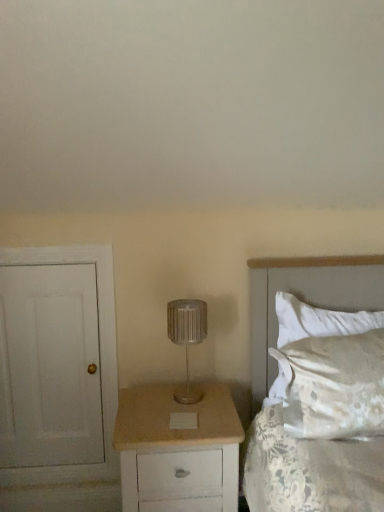
Question: Is white painted wood door at left positioned in front of white satin pillow at right?

Choices:
 (A) no
 (B) yes

Answer: (A)

Question: Does white painted wood door at left have a lesser width compared to white satin pillow at right?

Choices:
 (A) yes
 (B) no

Answer: (A)

Question: From the image's perspective, does white painted wood door at left appear higher than white satin pillow at right?

Choices:
 (A) yes
 (B) no

Answer: (B)

Question: Can you confirm if white painted wood door at left is shorter than white satin pillow at right?

Choices:
 (A) no
 (B) yes

Answer: (A)

Question: Is white satin pillow at right surrounded by white painted wood door at left?

Choices:
 (A) no
 (B) yes

Answer: (A)

Question: Is white painted wood door at left not within white satin pillow at right?

Choices:
 (A) yes
 (B) no

Answer: (A)

Question: Is white painted wood door at left in contact with white satin bed at right?

Choices:
 (A) yes
 (B) no

Answer: (B)

Question: Considering the relative sizes of white painted wood door at left and white satin bed at right in the image provided, is white painted wood door at left thinner than white satin bed at right?

Choices:
 (A) yes
 (B) no

Answer: (A)

Question: Is white painted wood door at left not within white satin bed at right?

Choices:
 (A) no
 (B) yes

Answer: (B)

Question: Is white painted wood door at left bigger than white satin bed at right?

Choices:
 (A) no
 (B) yes

Answer: (A)

Question: Is the depth of white painted wood door at left less than that of white satin bed at right?

Choices:
 (A) no
 (B) yes

Answer: (A)

Question: Is white satin bed at right a part of white painted wood door at left?

Choices:
 (A) no
 (B) yes

Answer: (A)

Question: Does beige wood chest of drawers at center lie behind white satin pillow at right?

Choices:
 (A) yes
 (B) no

Answer: (B)